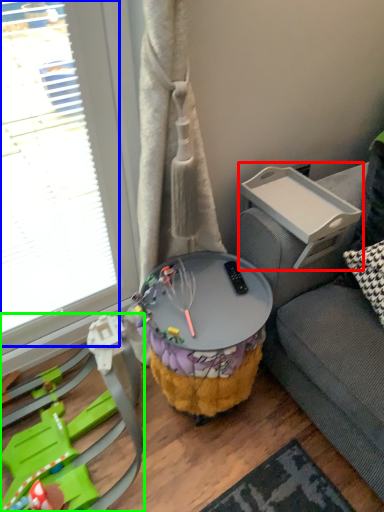
Question: Considering the real-world distances, which object is farthest from table (highlighted by a red box)? glass door (highlighted by a blue box) or toy (highlighted by a green box)?

Choices:
 (A) glass door
 (B) toy

Answer: (B)